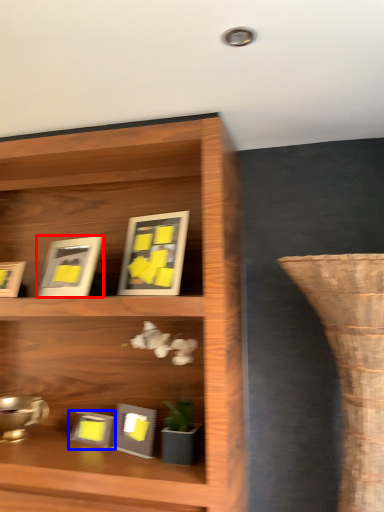
Question: Which object is further to the camera taking this photo, picture frame (highlighted by a red box) or picture frame (highlighted by a blue box)?

Choices:
 (A) picture frame
 (B) picture frame

Answer: (B)